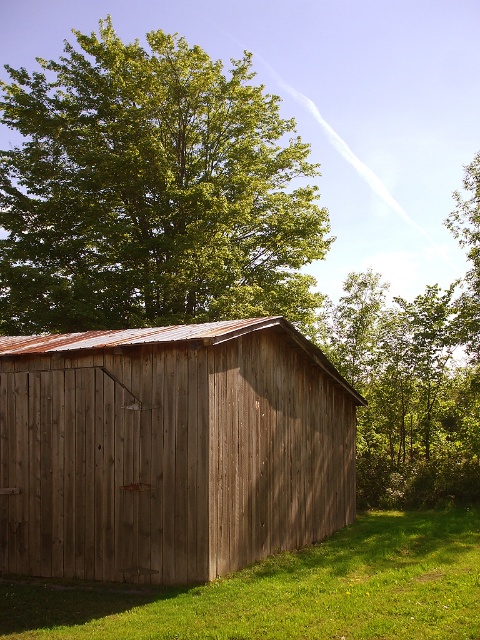
Question: Among these points, which one is farthest from the camera?

Choices:
 (A) (214, 340)
 (B) (388, 506)
 (C) (3, 625)

Answer: (B)

Question: Can you confirm if green leafy tree at upper left is smaller than green leafy tree at upper center?

Choices:
 (A) no
 (B) yes

Answer: (A)

Question: Is wooden barn at center bigger than green leafy tree at upper left?

Choices:
 (A) no
 (B) yes

Answer: (A)

Question: Based on their relative distances, which object is nearer to the green grass at lower right?

Choices:
 (A) wooden barn at center
 (B) green leafy tree at upper center
 (C) green leafy tree at upper left

Answer: (A)

Question: Does green leafy tree at upper left have a lesser width compared to green grass at lower right?

Choices:
 (A) no
 (B) yes

Answer: (A)

Question: Considering the real-world distances, which object is farthest from the green leafy tree at upper center?

Choices:
 (A) wooden barn at center
 (B) green grass at lower right
 (C) green leafy tree at upper left

Answer: (A)